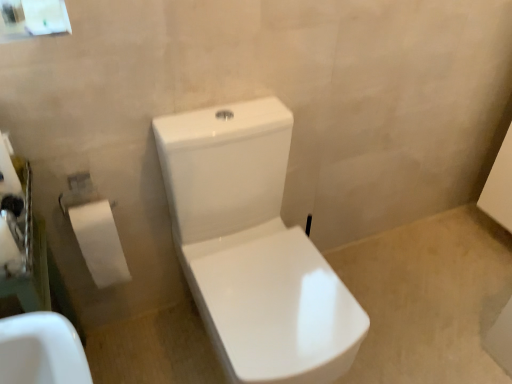
Locate an element on the screen. The width and height of the screenshot is (512, 384). white paper at left is located at coordinates tap(11, 246).

Identify the location of white paper at left. The image size is (512, 384). (99, 243).

This screenshot has height=384, width=512. What do you see at coordinates (253, 248) in the screenshot? I see `white glossy toilet at center` at bounding box center [253, 248].

I want to click on white paper at left, so click(11, 246).

How distant is white paper at left from white paper at left?

white paper at left is 15.47 inches away from white paper at left.

Between white paper at left and white paper at left, which one has larger width?

With larger width is white paper at left.

Is white paper at left to the left or to the right of white paper at left in the image?

white paper at left is positioned on white paper at left's left side.

Is white paper at left located within white paper at left?

No, white paper at left is not a part of white paper at left.

In terms of height, does white glossy toilet at center look taller or shorter compared to white paper at left?

Clearly, white glossy toilet at center is taller compared to white paper at left.

From the image's perspective, is white glossy toilet at center under white paper at left?

Correct, white glossy toilet at center appears lower than white paper at left in the image.

Relative to white paper at left, is white glossy toilet at center in front or behind?

In the image, white glossy toilet at center appears in front of white paper at left.

Is white glossy toilet at center surrounding white paper at left?

Definitely not — white paper at left is not inside white glossy toilet at center.

Is white paper at left located within white paper at left?

No, white paper at left is not inside white paper at left.

Is white paper at left turned away from white paper at left?

No, white paper at left is not at the back of white paper at left.

Is white paper at left thinner than white paper at left?

No, white paper at left is not thinner than white paper at left.

Considering the sizes of objects white paper at left and white glossy toilet at center in the image provided, who is shorter, white paper at left or white glossy toilet at center?

white paper at left is shorter.

I want to click on toilet on the right of white paper at left, so click(x=253, y=248).

Does white paper at left appear on the right side of white glossy toilet at center?

No.

From the image's perspective, relative to white glossy toilet at center, is white paper at left above or below?

white paper at left is above white glossy toilet at center.

Between point (220, 318) and point (13, 267), which one is positioned behind?

The point (220, 318) is behind.

Considering the positions of objects white glossy toilet at center and white paper at left in the image provided, who is more to the right, white glossy toilet at center or white paper at left?

From the viewer's perspective, white glossy toilet at center appears more on the right side.

Are white glossy toilet at center and white paper at left located far from each other?

No, white glossy toilet at center is in close proximity to white paper at left.

Considering the sizes of white paper at left and white glossy toilet at center in the image, is white paper at left taller or shorter than white glossy toilet at center?

Clearly, white paper at left is shorter compared to white glossy toilet at center.

Which object is closer to the camera, white paper at left or white glossy toilet at center?

white glossy toilet at center is closer to the camera.

From the image's perspective, is white paper at left over white glossy toilet at center?

Yes.

Between white paper at left and white glossy toilet at center, which one appears on the right side from the viewer's perspective?

Positioned to the right is white glossy toilet at center.

I want to click on toiletry below the white paper at left (from the image's perspective), so click(99, 243).

In order to click on toiletry above the white glossy toilet at center (from the image's perspective) in this screenshot , I will do `click(99, 243)`.

When comparing their distances from white glossy toilet at center, does white paper at left or white paper at left seem further?

Among the two, white paper at left is located further to white glossy toilet at center.

From the image, which object appears to be nearer to white paper at left, white glossy toilet at center or white paper at left?

white paper at left.

From the image, which object appears to be nearer to white glossy toilet at center, white paper at left or white paper at left?

white paper at left is closer to white glossy toilet at center.

From the image, which object appears to be farther from white paper at left, white glossy toilet at center or white paper at left?

white paper at left is further to white paper at left.

From the image, which object appears to be farther from white paper at left, white paper at left or white glossy toilet at center?

Based on the image, white paper at left appears to be further to white paper at left.

Based on their spatial positions, is white paper at left or white glossy toilet at center closer to white paper at left?

white paper at left lies closer to white paper at left than the other object.

Image resolution: width=512 pixels, height=384 pixels. What are the coordinates of `toiletry situated between white paper at left and white glossy toilet at center from left to right` in the screenshot? It's located at (99, 243).